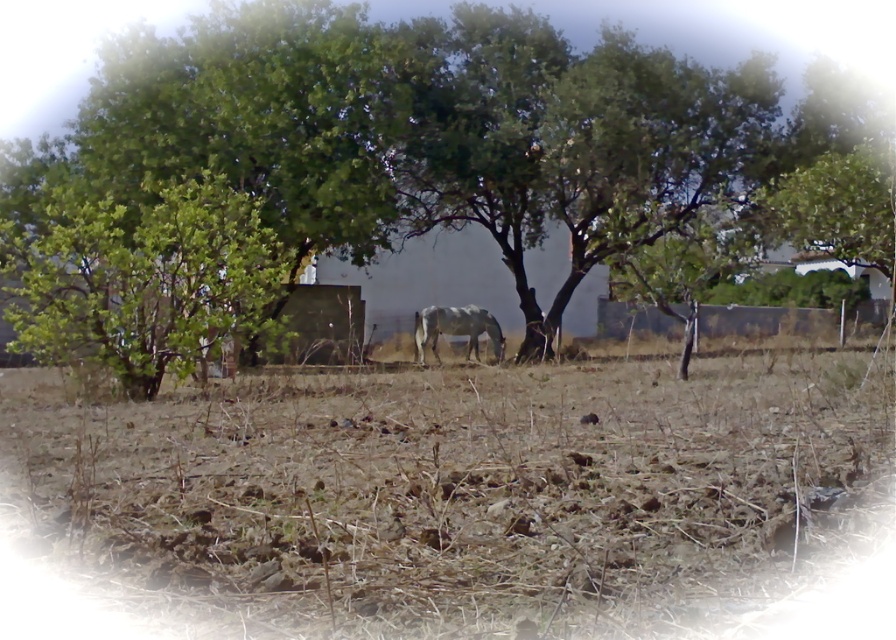
Question: Can you confirm if brown dry dirt at center is bigger than gray matte horse at center?

Choices:
 (A) yes
 (B) no

Answer: (B)

Question: From the image, what is the correct spatial relationship of brown dry dirt at center in relation to green leafy tree at center?

Choices:
 (A) below
 (B) above

Answer: (A)

Question: Which of the following is the closest to the observer?

Choices:
 (A) gray matte horse at center
 (B) green leafy tree at center

Answer: (B)

Question: Which object appears closest to the camera in this image?

Choices:
 (A) green leafy tree at center
 (B) gray matte horse at center

Answer: (A)

Question: Is brown dry dirt at center to the left of gray matte horse at center from the viewer's perspective?

Choices:
 (A) no
 (B) yes

Answer: (A)

Question: Estimate the real-world distances between objects in this image. Which object is farther from the brown dry dirt at center?

Choices:
 (A) gray matte horse at center
 (B) green leafy tree at center

Answer: (B)